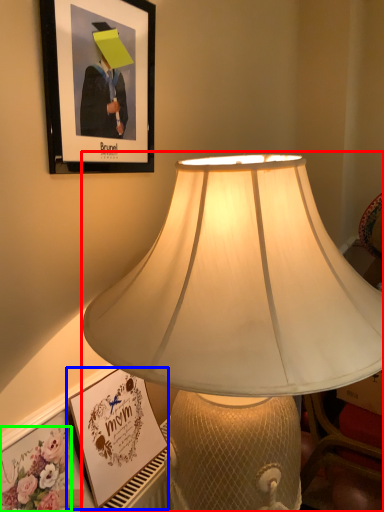
Question: Which object is positioned farthest from lamp (highlighted by a red box)? Select from picture frame (highlighted by a blue box) and flower (highlighted by a green box).

Choices:
 (A) picture frame
 (B) flower

Answer: (B)